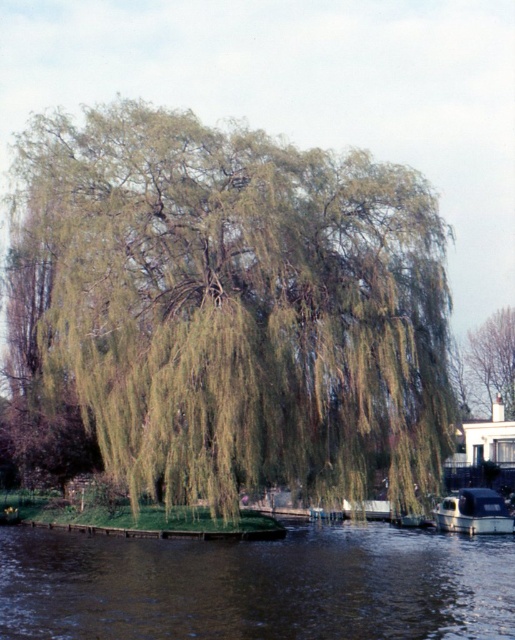
You are standing at the camera position and want to reach point (x=500, y=324). If your walking speed is 3 feet per second, how many seconds will it take to reach there?

The distance between the camera and point (x=500, y=324) is 312.19 feet. At a walking speed of 3 feet per second, it would take approximately 104 seconds to reach there.

You are planning to take a photo of the green leafy tree at upper right and the shiny black boat at lower right from the riverside. Which object will appear wider in your photo?

The green leafy tree at upper right will appear wider in the photo because its width surpasses that of the shiny black boat at lower right.

You are a photographer planning to take a wide shot of the green leafy willow at center and the brown water at lower center. Based on their sizes, which object should you focus on to ensure both are fully captured in the frame?

The green leafy willow at center might be wider than brown water at lower center, so focusing on the willow will ensure both are fully captured in the frame.